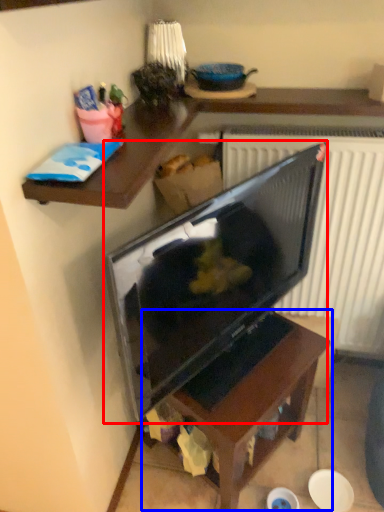
Question: Which object is further to the camera taking this photo, television (highlighted by a red box) or table (highlighted by a blue box)?

Choices:
 (A) television
 (B) table

Answer: (B)